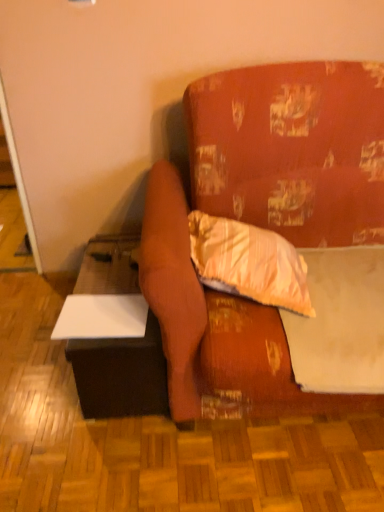
You are a GUI agent. You are given a task and a screenshot of the screen. Output one action in this format:
    pyautogui.click(x=<x>, y=<y>)
    Task: Click on the free space to the left of white matte table at lower left
    The height and width of the screenshot is (512, 384).
    Given the screenshot: What is the action you would take?
    pyautogui.click(x=31, y=344)